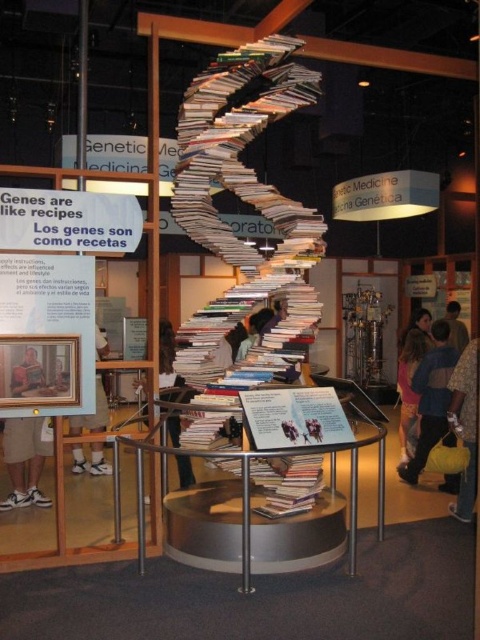
Is dark blue jeans at center closer to the viewer compared to dark brown hair at upper right?

Yes, it is in front of dark brown hair at upper right.

Does point (160, 323) lie behind point (451, 321)?

No, it is in front of (451, 321).

Between point (166, 355) and point (450, 317), which one is positioned behind?

Point (450, 317)

Find the location of a particular element. This screenshot has width=480, height=640. dark blue jeans at center is located at coordinates (168, 356).

Between point (407, 452) and point (447, 323), which one is positioned in front?

Point (407, 452) is more forward.

Does pink fabric dress at lower right have a greater width compared to dark brown hair at upper right?

No, pink fabric dress at lower right is not wider than dark brown hair at upper right.

Where is `pink fabric dress at lower right`? pink fabric dress at lower right is located at coordinates (409, 392).

Find the location of a particular element. pink fabric dress at lower right is located at coordinates (409, 392).

Does point (420, 452) come farther from viewer compared to point (187, 467)?

Yes.

Is blue denim jacket at lower right behind dark blue jeans at center?

Yes, it is.

In order to click on blue denim jacket at lower right in this screenshot , I will do `click(432, 397)`.

Identify the location of blue denim jacket at lower right. (432, 397).